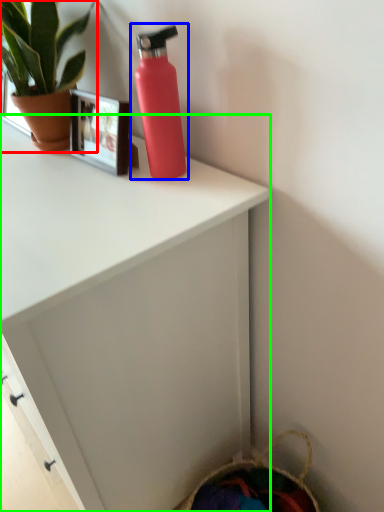
Question: Estimate the real-world distances between objects in this image. Which object is farther from houseplant (highlighted by a red box), bottle (highlighted by a blue box) or desk (highlighted by a green box)?

Choices:
 (A) bottle
 (B) desk

Answer: (B)